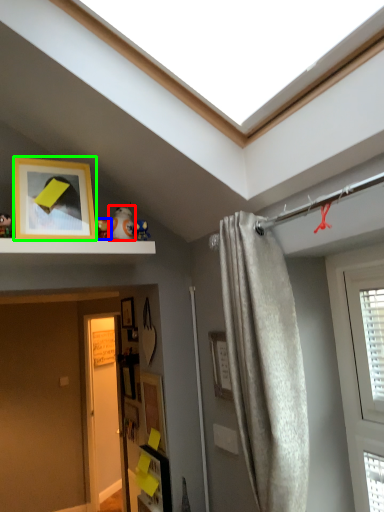
Question: Estimate the real-world distances between objects in this image. Which object is closer to toy (highlighted by a red box), toy (highlighted by a blue box) or picture frame (highlighted by a green box)?

Choices:
 (A) toy
 (B) picture frame

Answer: (A)